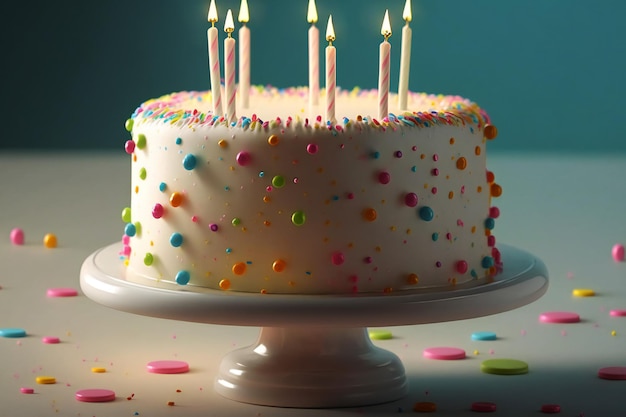
Where is `birthday candles`? The image size is (626, 417). birthday candles is located at coordinates (244, 61), (231, 69), (217, 71), (312, 52), (330, 83), (385, 82), (406, 65).